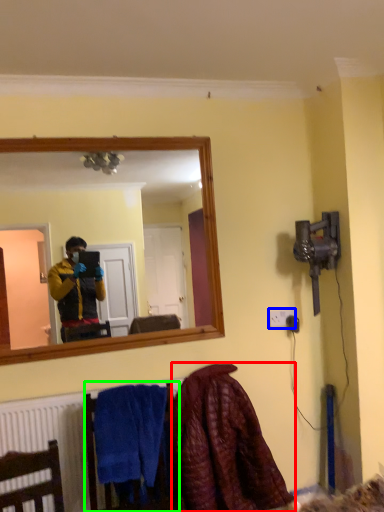
Question: Estimate the real-world distances between objects in this image. Which object is closer to blanket (highlighted by a red box), electric outlet (highlighted by a blue box) or armchair (highlighted by a green box)?

Choices:
 (A) electric outlet
 (B) armchair

Answer: (B)